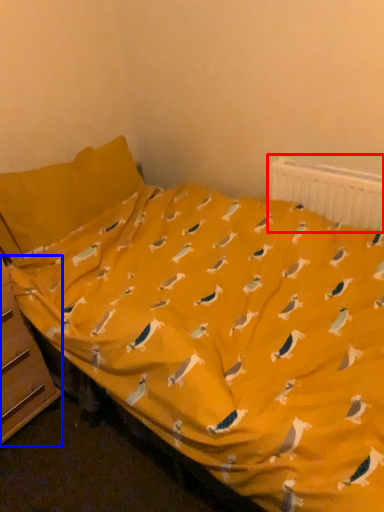
Question: Among these objects, which one is farthest to the camera, radiator (highlighted by a red box) or file cabinet (highlighted by a blue box)?

Choices:
 (A) radiator
 (B) file cabinet

Answer: (A)